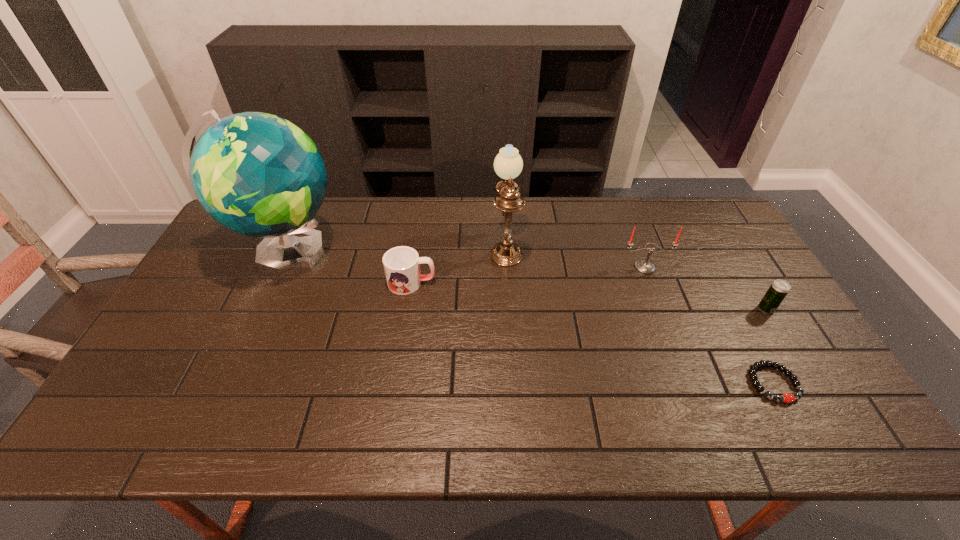
This screenshot has width=960, height=540. In order to click on the tallest object in this screenshot , I will do `click(257, 174)`.

Locate an element on the screen. the leftmost object is located at coordinates (257, 174).

Where is `oil lamp`? oil lamp is located at coordinates (508, 164).

This screenshot has width=960, height=540. I want to click on the third object from left to right, so click(508, 164).

Locate an element on the screen. candle is located at coordinates (644, 266).

Locate an element on the screen. the third object from right to left is located at coordinates (644, 266).

Image resolution: width=960 pixels, height=540 pixels. Identify the location of the fifth object from right to left. (401, 264).

Where is `beer can`? The width and height of the screenshot is (960, 540). beer can is located at coordinates (778, 290).

Where is `the rightmost object`? the rightmost object is located at coordinates (778, 290).

Identify the location of the fifth object from left to right. This screenshot has width=960, height=540. (787, 398).